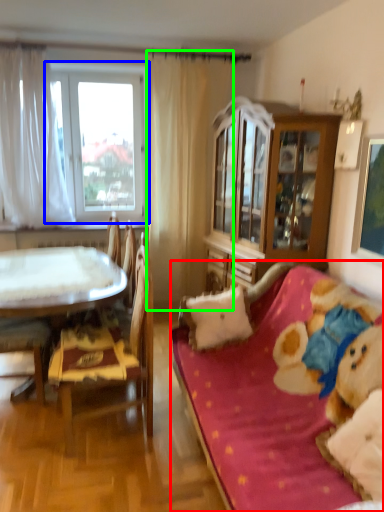
Question: Which is farther away from studio couch (highlighted by a red box)? window (highlighted by a blue box) or curtain (highlighted by a green box)?

Choices:
 (A) window
 (B) curtain

Answer: (A)